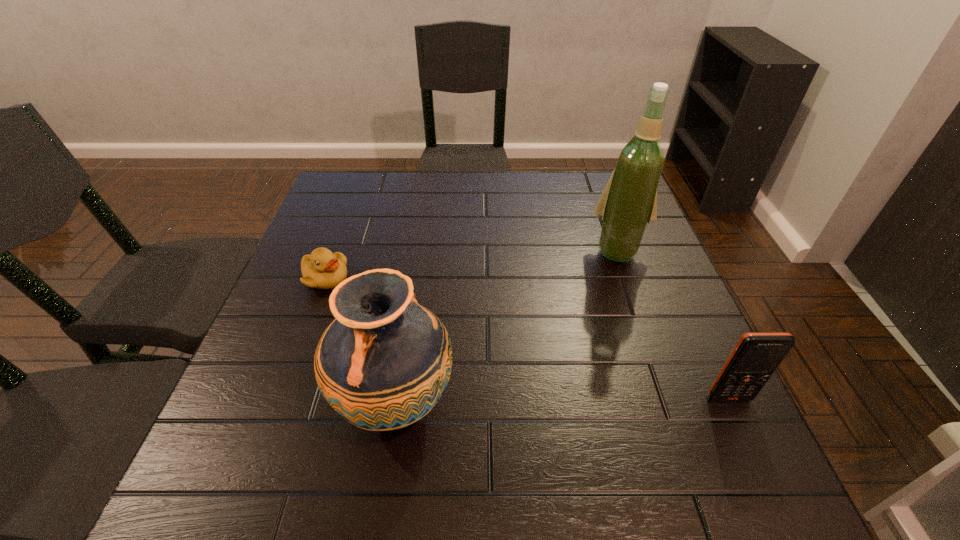
What are the coordinates of `empty space that is in between the tallest object and the pottery` in the screenshot? It's located at (507, 326).

What are the coordinates of `vacant area that lies between the tallest object and the third object from right to left` in the screenshot? It's located at (507, 326).

Locate an element on the screen. The height and width of the screenshot is (540, 960). empty space between the tallest object and the second object from left to right is located at coordinates (507, 326).

I want to click on the closest object to the wine bottle, so click(x=756, y=356).

The image size is (960, 540). Find the location of `object that stands as the closest to the duckling`. object that stands as the closest to the duckling is located at coordinates (383, 363).